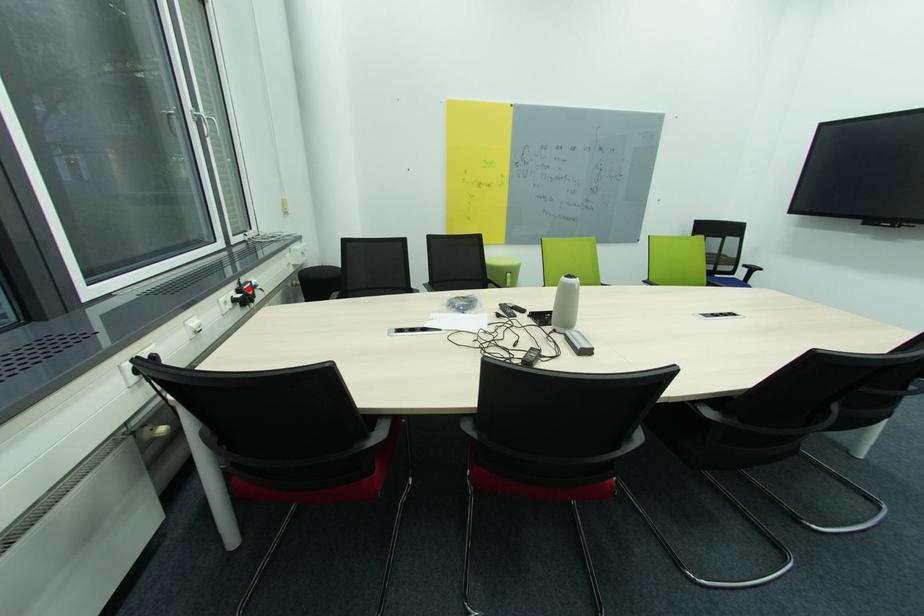
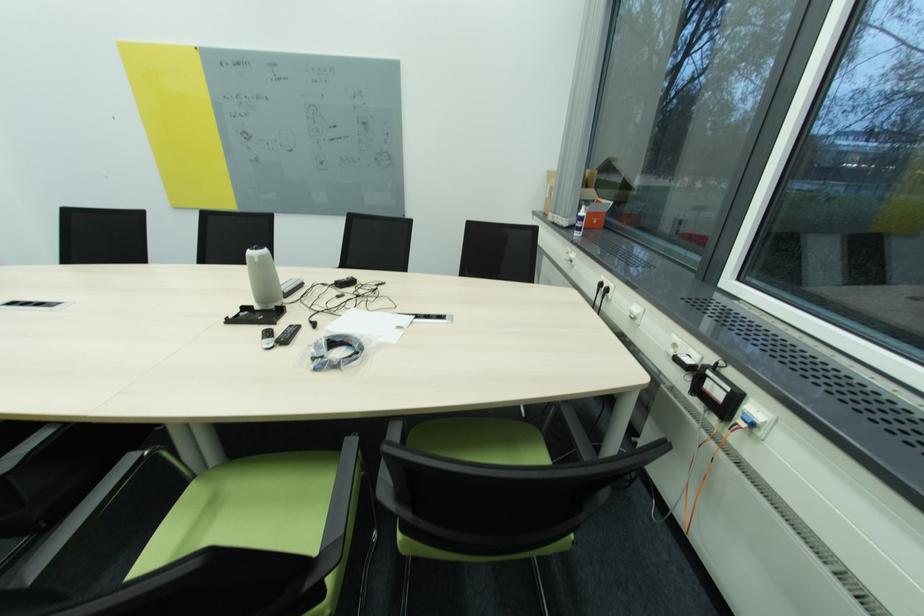
Locate, in the second image, the point that corresponds to the highlighted location in the first image.

(713, 373)